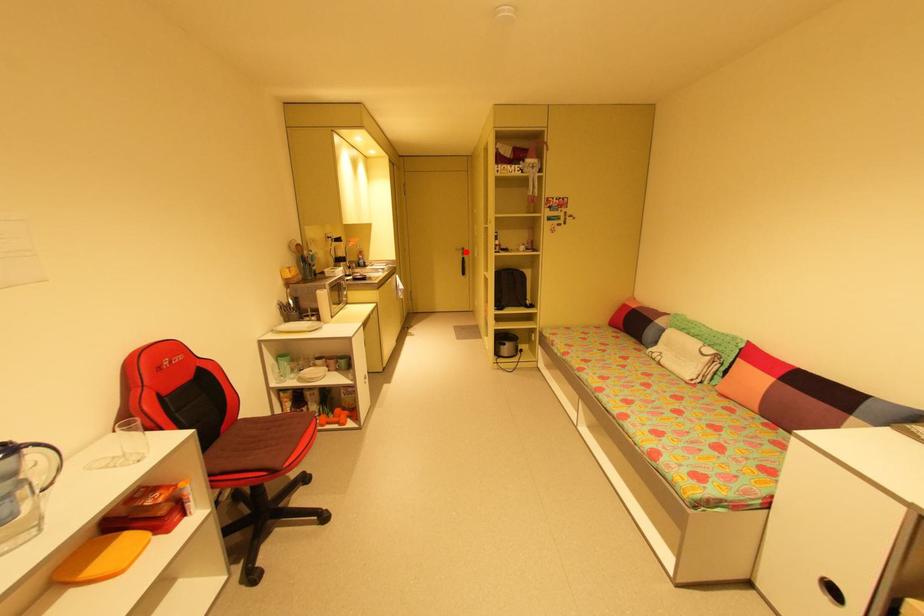
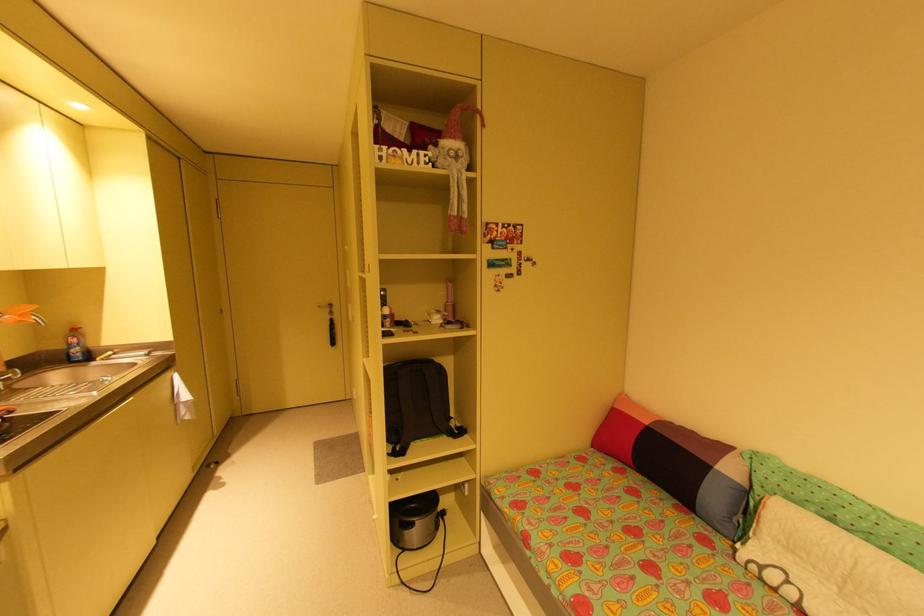
Find the pixel in the second image that matches the highlighted location in the first image.

(333, 310)